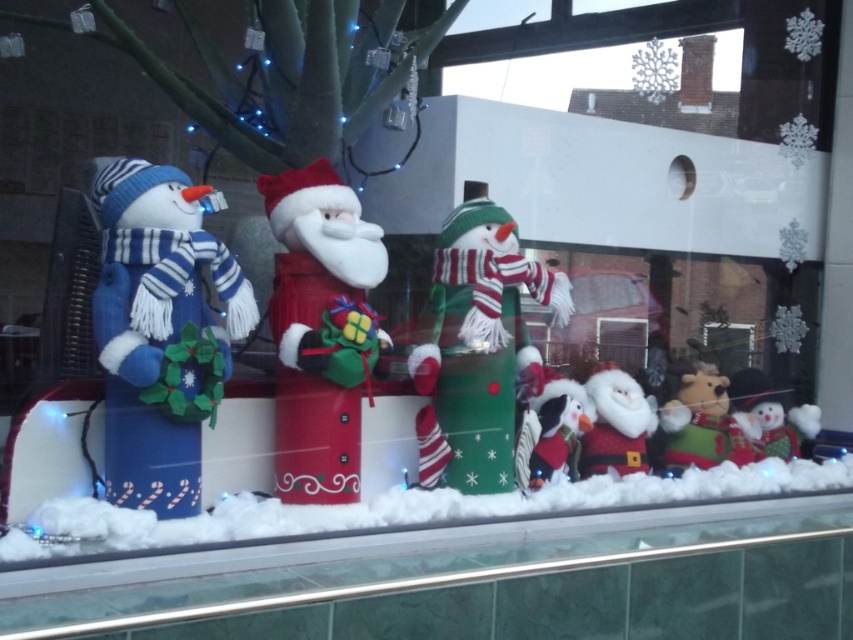
You are a delivery person who needs to place a new ornament on the shelf. The ornament is 12 inches wide. The shelf has space between the white frosted glass at lower center and the velvet red santa at center. Can the ornament fit in that space?

The white frosted glass at lower center might be wider than the velvet red santa at center, so the space between them may or may not accommodate the 12 inch ornament. Check the actual width before placing it.

You are a visitor standing in front of the Christmas display. You see the blue plush snowman at left and the velvet red santa at center. Which one is positioned to the left of the other?

The blue plush snowman at left is positioned to the left of the velvet red santa at center.